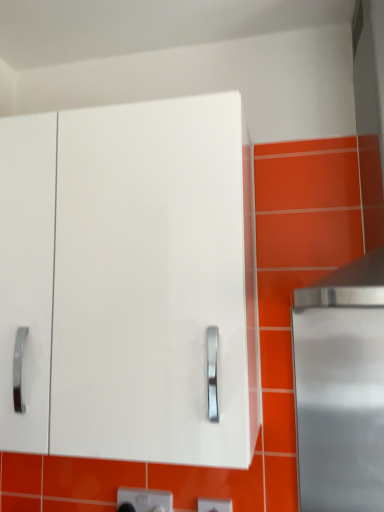
Question: From a real-world perspective, is white plastic electric outlet at lower center, the 2th electric outlet from the back, on white plastic electric outlet at lower center, positioned as the 2th electric outlet in right-to-left order?

Choices:
 (A) yes
 (B) no

Answer: (B)

Question: Considering the relative sizes of white plastic electric outlet at lower center, which is counted as the first electric outlet, starting from the right, and white plastic electric outlet at lower center, which appears as the 1th electric outlet when viewed from the back, in the image provided, is white plastic electric outlet at lower center, which is counted as the first electric outlet, starting from the right, thinner than white plastic electric outlet at lower center, which appears as the 1th electric outlet when viewed from the back,?

Choices:
 (A) yes
 (B) no

Answer: (A)

Question: Can you confirm if white plastic electric outlet at lower center, which is counted as the first electric outlet, starting from the right, is wider than white plastic electric outlet at lower center, positioned as the second electric outlet in front-to-back order?

Choices:
 (A) yes
 (B) no

Answer: (B)

Question: Is white plastic electric outlet at lower center, which is counted as the first electric outlet, starting from the front, surrounding white plastic electric outlet at lower center, positioned as the second electric outlet in front-to-back order?

Choices:
 (A) yes
 (B) no

Answer: (B)

Question: Would you say white plastic electric outlet at lower center, which is counted as the first electric outlet, starting from the front, is outside white plastic electric outlet at lower center, which appears as the 1th electric outlet when viewed from the back?

Choices:
 (A) yes
 (B) no

Answer: (A)

Question: Based on their sizes in the image, would you say white plastic electric outlet at lower center, which appears as the 1th electric outlet when viewed from the back, is bigger or smaller than white plastic electric outlet at lower center, which is counted as the first electric outlet, starting from the front?

Choices:
 (A) big
 (B) small

Answer: (A)

Question: From the image's perspective, is white plastic electric outlet at lower center, positioned as the 2th electric outlet in right-to-left order, positioned above or below white plastic electric outlet at lower center, the 2th electric outlet from the back?

Choices:
 (A) above
 (B) below

Answer: (B)

Question: From a real-world perspective, is white plastic electric outlet at lower center, which appears as the 1th electric outlet when viewed from the back, positioned above or below white plastic electric outlet at lower center, the 2th electric outlet from the back?

Choices:
 (A) below
 (B) above

Answer: (B)

Question: Would you say white plastic electric outlet at lower center, which is counted as the 1th electric outlet, starting from the left, is inside or outside white plastic electric outlet at lower center, which is the second electric outlet in left-to-right order?

Choices:
 (A) outside
 (B) inside

Answer: (A)

Question: Considering their positions, is white plastic electric outlet at lower center, which is counted as the first electric outlet, starting from the right, located in front of or behind white plastic electric outlet at lower center, positioned as the 2th electric outlet in right-to-left order?

Choices:
 (A) behind
 (B) front

Answer: (B)

Question: Is point (201, 502) positioned closer to the camera than point (134, 492)?

Choices:
 (A) farther
 (B) closer

Answer: (B)

Question: Looking at the image, does white plastic electric outlet at lower center, which is counted as the first electric outlet, starting from the front, seem bigger or smaller compared to white plastic electric outlet at lower center, positioned as the 2th electric outlet in right-to-left order?

Choices:
 (A) big
 (B) small

Answer: (B)

Question: From their relative heights in the image, would you say white plastic electric outlet at lower center, the 2th electric outlet from the back, is taller or shorter than white plastic electric outlet at lower center, which appears as the 1th electric outlet when viewed from the back?

Choices:
 (A) tall
 (B) short

Answer: (B)

Question: In terms of width, does white plastic electric outlet at lower center, which is counted as the 1th electric outlet, starting from the left, look wider or thinner when compared to white glossy cabinet at center?

Choices:
 (A) thin
 (B) wide

Answer: (A)

Question: Is point (157, 507) closer or farther from the camera than point (226, 215)?

Choices:
 (A) farther
 (B) closer

Answer: (A)